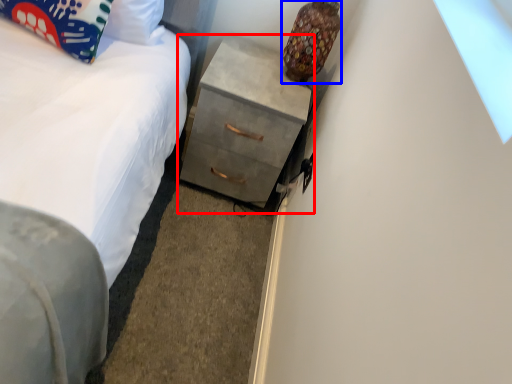
Question: Which point is closer to the camera, chest of drawers (highlighted by a red box) or lamp (highlighted by a blue box)?

Choices:
 (A) chest of drawers
 (B) lamp

Answer: (B)